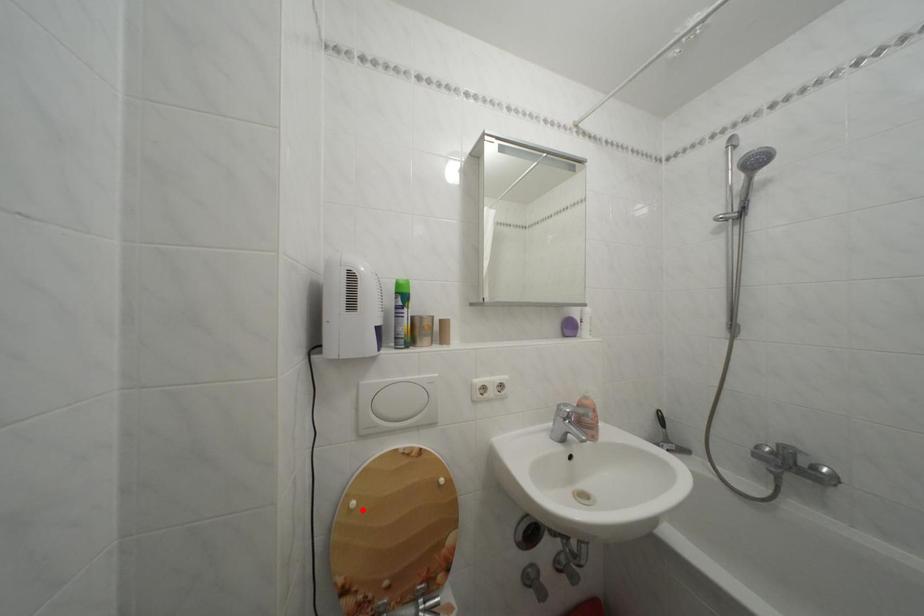
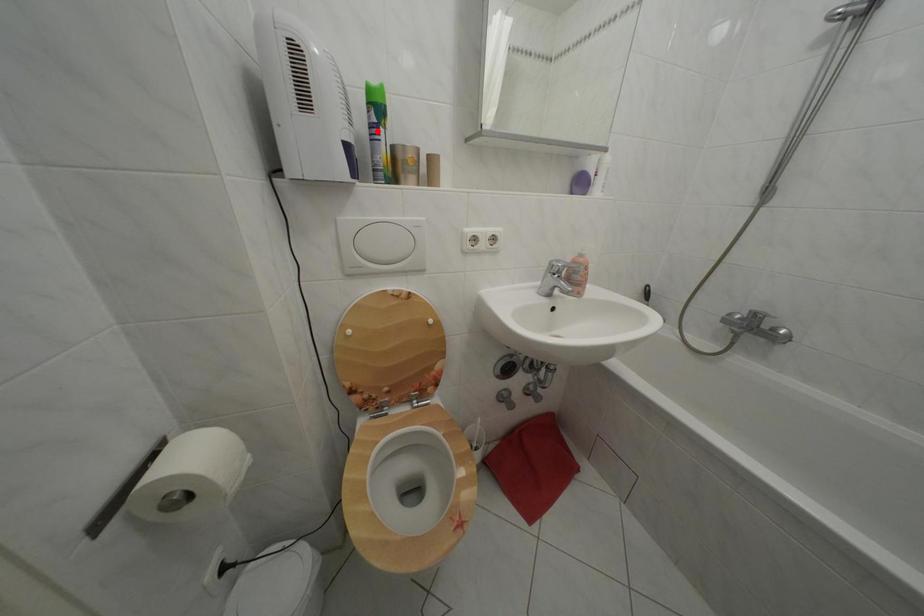
I am providing you with two images of the same scene from different viewpoints. A red point is marked on the first image and another point is marked on the second image. Is the marked point in image1 the same physical position as the marked point in image2?

No